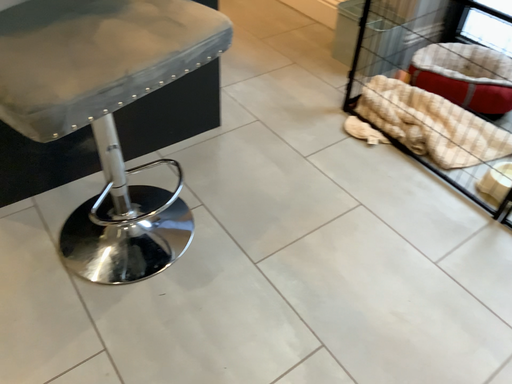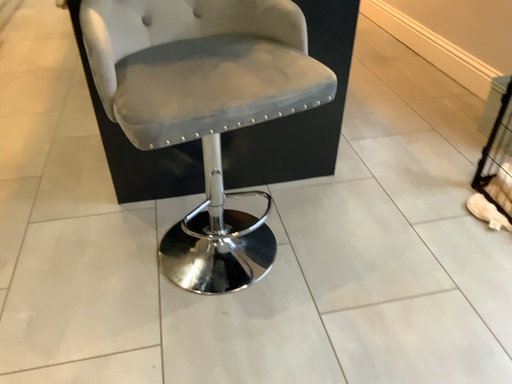
Question: How did the camera likely rotate when shooting the video?

Choices:
 (A) rotated upward
 (B) rotated downward

Answer: (A)